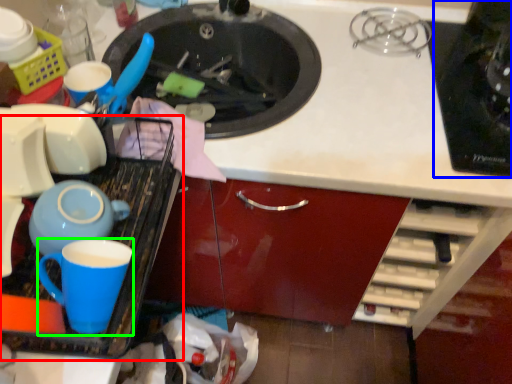
Question: Considering the real-world distances, which object is closest to kitchen appliance (highlighted by a red box)? appliance (highlighted by a blue box) or coffee cup (highlighted by a green box).

Choices:
 (A) appliance
 (B) coffee cup

Answer: (B)